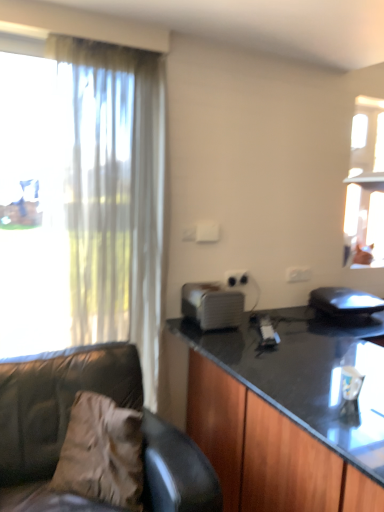
Question: From a real-world perspective, is white plastic toaster at center, which appears as the second appliance when viewed from the right, physically located above or below black plastic laptop at right, positioned as the second appliance in left-to-right order?

Choices:
 (A) above
 (B) below

Answer: (A)

Question: Is point (228, 290) closer or farther from the camera than point (321, 287)?

Choices:
 (A) farther
 (B) closer

Answer: (B)

Question: Which object is positioned farthest from the leather couch at left?

Choices:
 (A) black plastic laptop at right, positioned as the second appliance in left-to-right order
 (B) translucent fabric curtain at left
 (C) brown fabric pillow at lower left
 (D) black glossy cabinet at right
 (E) white plastic toaster at center, positioned as the first appliance in left-to-right order

Answer: (A)

Question: Which is nearer to the leather couch at left?

Choices:
 (A) brown fabric pillow at lower left
 (B) white plastic power outlet at center
 (C) translucent fabric curtain at left
 (D) black glossy cabinet at right
 (E) white plastic toaster at center, which appears as the second appliance when viewed from the right

Answer: (A)